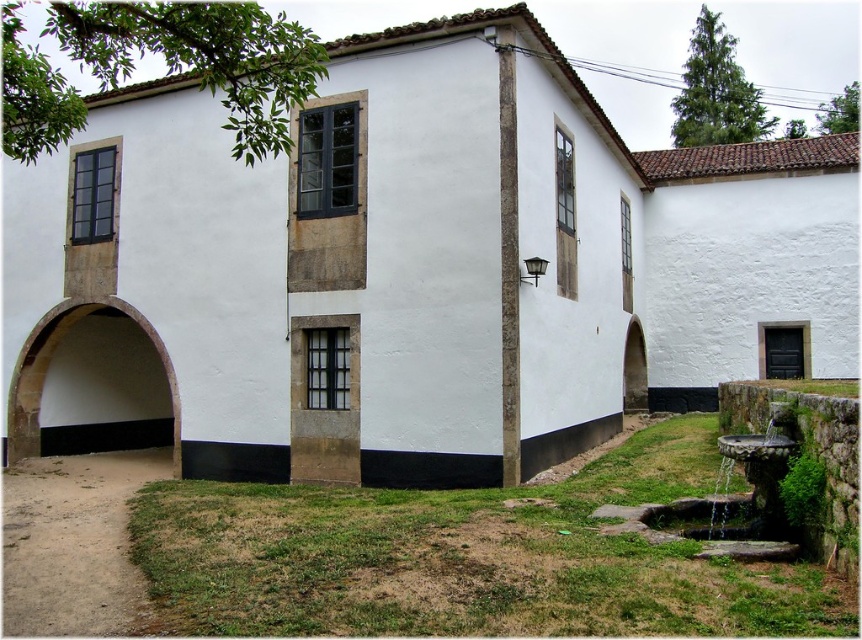
Between brown stone archway at lower left and white stone archway at right, which one appears on the right side from the viewer's perspective?

white stone archway at right is more to the right.

Between brown stone archway at lower left and white stone archway at right, which one has less height?

white stone archway at right is shorter.

Between point (14, 413) and point (628, 353), which one is positioned in front?

Point (14, 413)

At what (x,y) coordinates should I click in order to perform the action: click on brown stone archway at lower left. Please return your answer as a coordinate pair (x, y). Looking at the image, I should click on (48, 362).